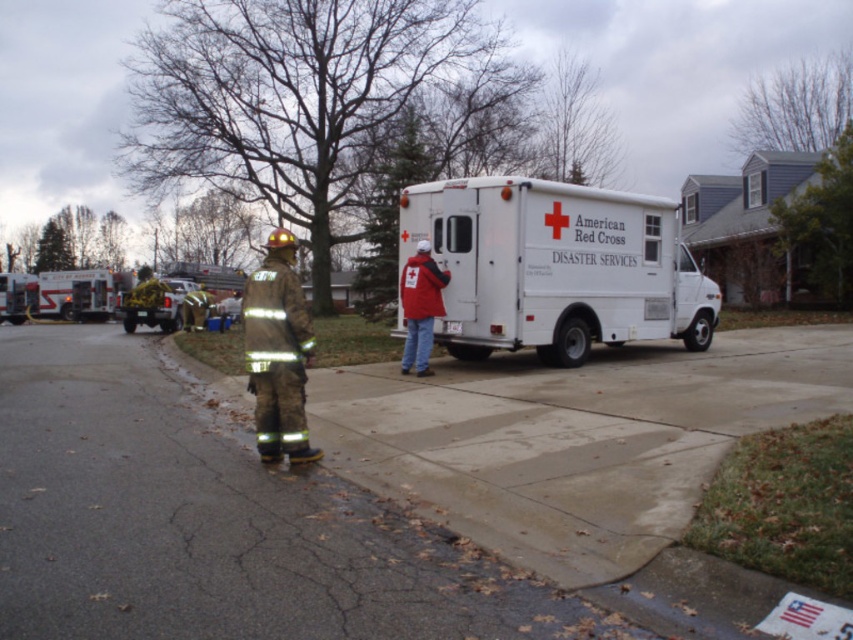
You are a pedestrian trying to cross the road safely. The camouflage fabric fireman at center is blocking your path. Can you walk around them towards the yellow reflective truck at left without getting too close?

The camouflage fabric fireman at center is positioned under the yellow reflective truck at left, so the fireman is directly beneath the truck. This means the truck is overhead, so you can walk around the fireman to the left side since the truck is above and not blocking the path.

You are a drone operator assigned to monitor the emergency scene. Your drone has a maximum operational range of 45 feet. Can your drone reach the white matte van at center from your current position?

The white matte van at center is 44.66 feet away from camera. Since the drone has a maximum operational range of 45 feet, it can reach the white matte van at center as the distance is within its range.

You are a pedestrian trying to cross the road safely. You see the white matte van at center and the yellow reflective truck at left. Which vehicle should you avoid walking in front of if you want to stay out of the drivers field of view?

The yellow reflective truck at left is to the left of the white matte van at center, so drivers in the yellow reflective truck at left would have a better field of view to the left side of the road. Therefore, you should avoid walking in front of the yellow reflective truck at left to stay out of the driver field of view.